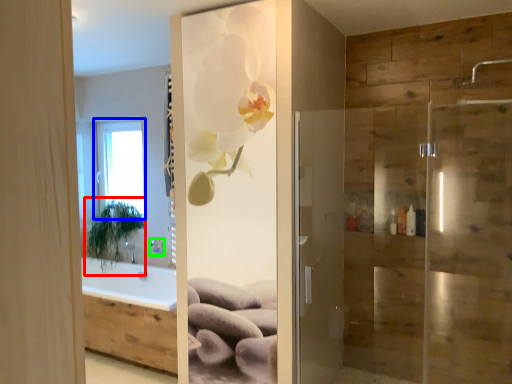
Question: Considering the real-world distances, which object is closest to plant (highlighted by a red box)? window (highlighted by a blue box) or shower (highlighted by a green box).

Choices:
 (A) window
 (B) shower

Answer: (A)